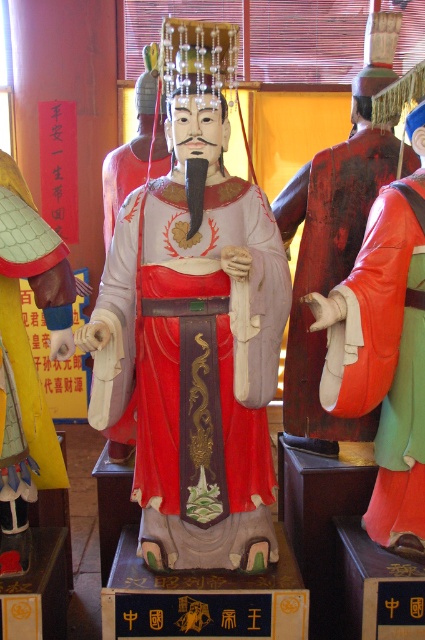
You are standing in front of the statues and want to reach a point exactly 6.90 feet away from your current position. Can you confirm if the point at coordinates point [232,44] is exactly 6.90 feet away from you?

Yes, the point at coordinates point [232,44] is exactly 6.90 feet away from you.

You are standing in front of the statues and want to determine which point is closer to you. Which point is closer to you, point (192, 452) or point (424, 70)?

Point (192, 452) is closer to you than point (424, 70).